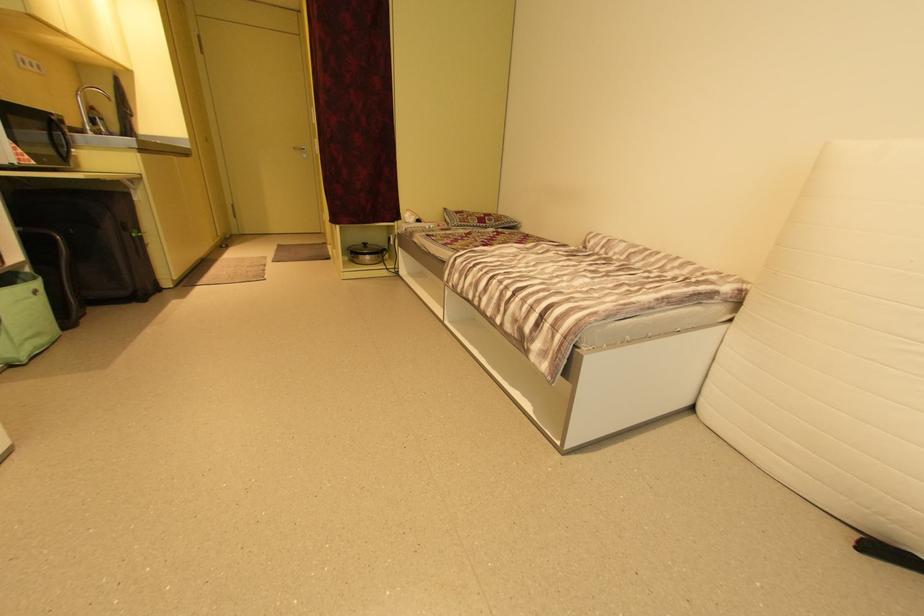
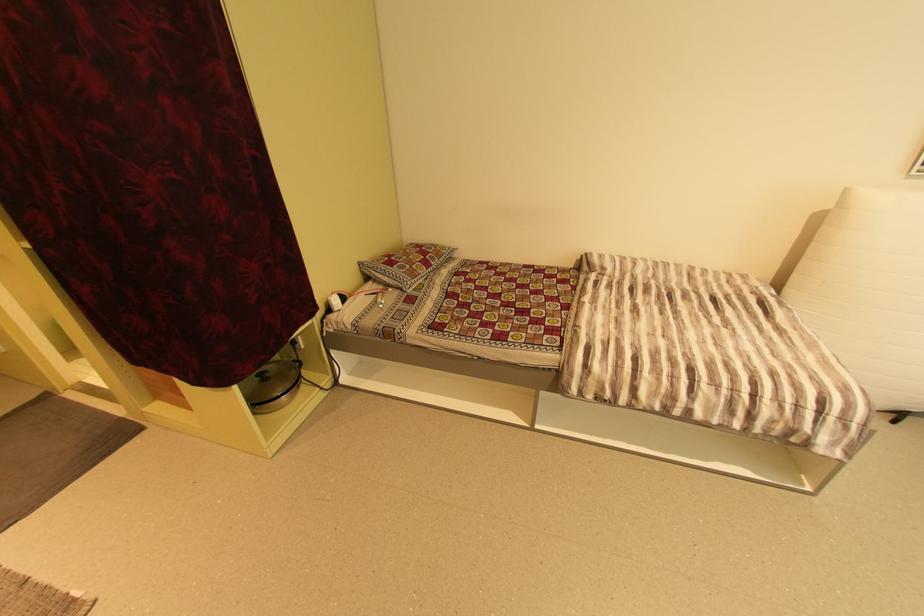
In the second image, find the point that corresponds to point 370,246 in the first image.

(265, 379)